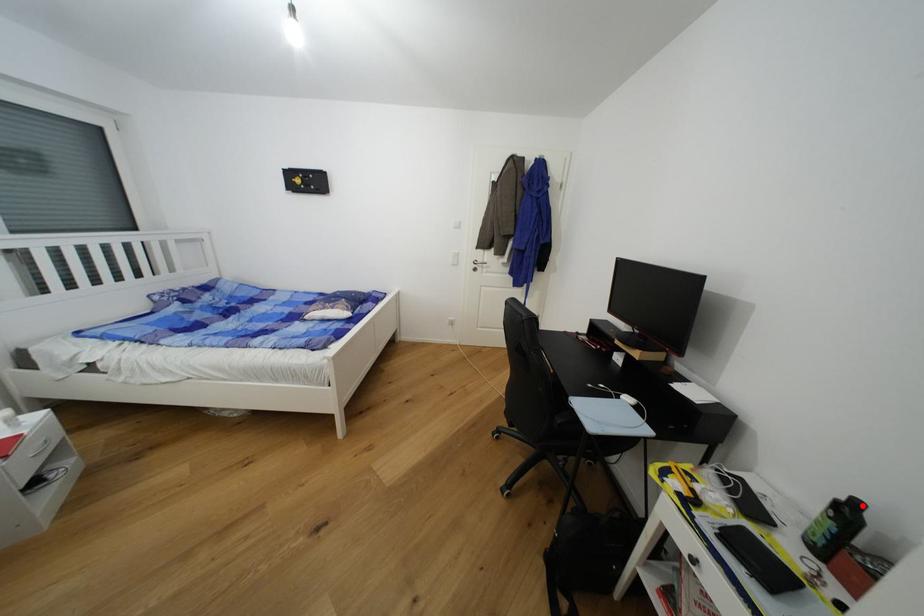
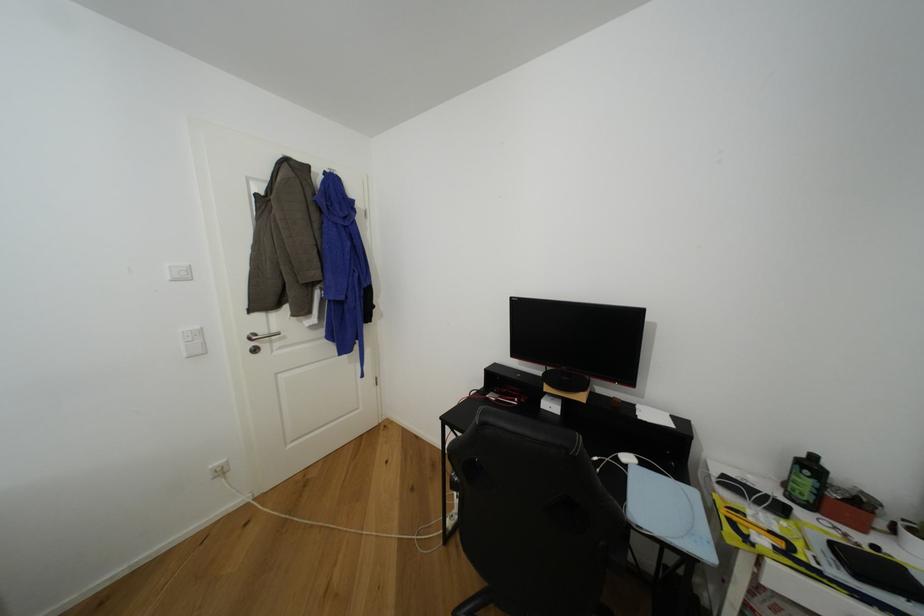
The point at the highlighted location is marked in the first image. Where is the corresponding point in the second image?

(820, 459)